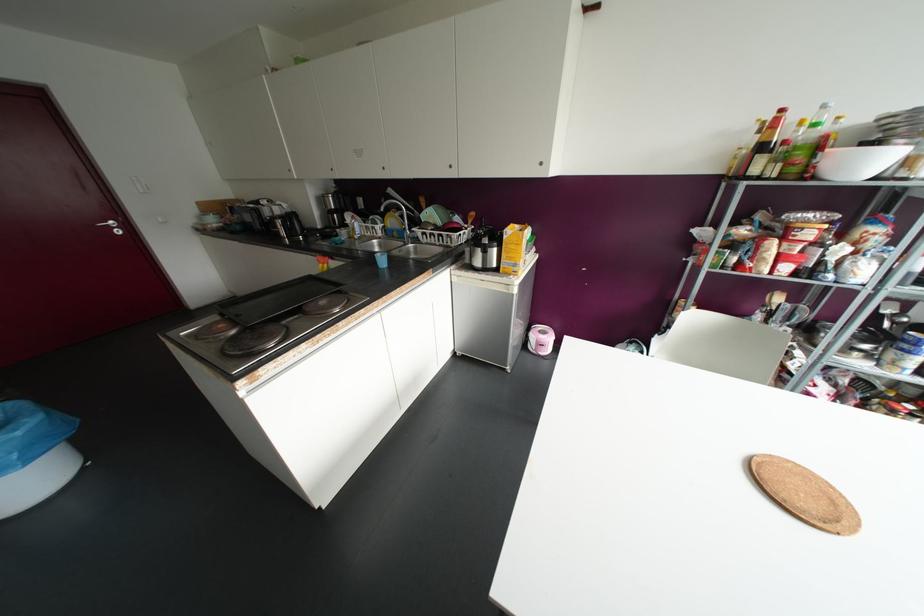
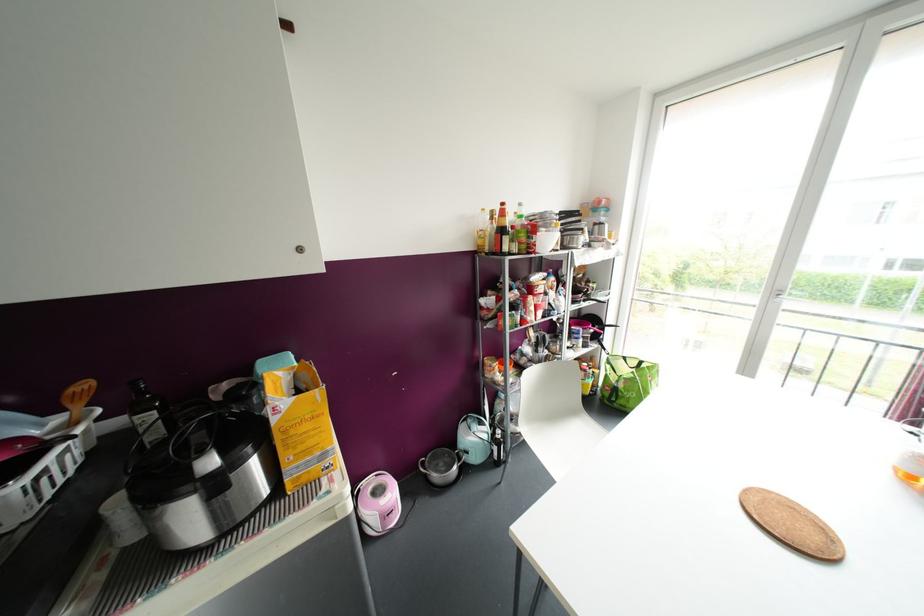
Where in the second image is the point corresponding to the point at 781,110 from the first image?

(502, 204)